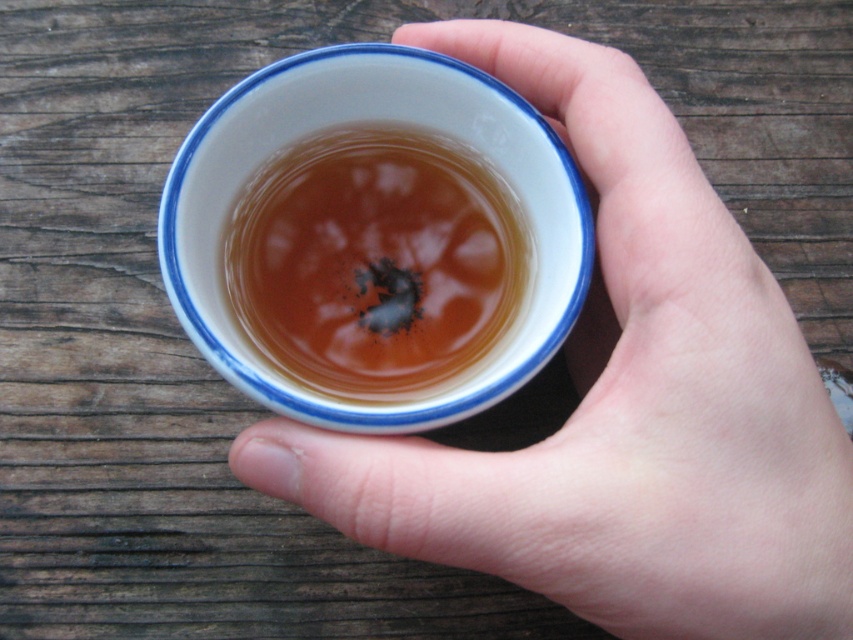
You are a tea server at a ceremony. You need to pour the translucent amber liquid at center into the white glossy cup at center. Can you do this without spilling any liquid?

The white glossy cup at center is in front of the translucent amber liquid at center, so pouring the liquid into the cup would require moving the cup behind the liquid, which is not possible. Therefore, you cannot pour the liquid into the cup without spilling.

You are a photographer trying to capture a close up of the white glossy cup at center. The camera is positioned at a distance where the cup appears sharp. If you move the camera closer by 2 inches, will the cup still be in focus?

The white glossy cup at center is currently 11.71 inches from the camera. Moving the camera closer by 2 inches would reduce the distance to 9.71 inches. Since the focus distance is adjusted for 11.71 inches, moving closer may cause the cup to go out of focus unless the focus is readjusted. Therefore, the cup might not remain in focus without refocusing.

You are a barista preparing a drink and need to pour the translucent amber liquid at center into the white glossy cup at center. Can you pour the entire liquid into the cup without spilling?

The white glossy cup at center has a larger width than the translucent amber liquid at center, so yes, you can pour the entire liquid into the cup without spilling.